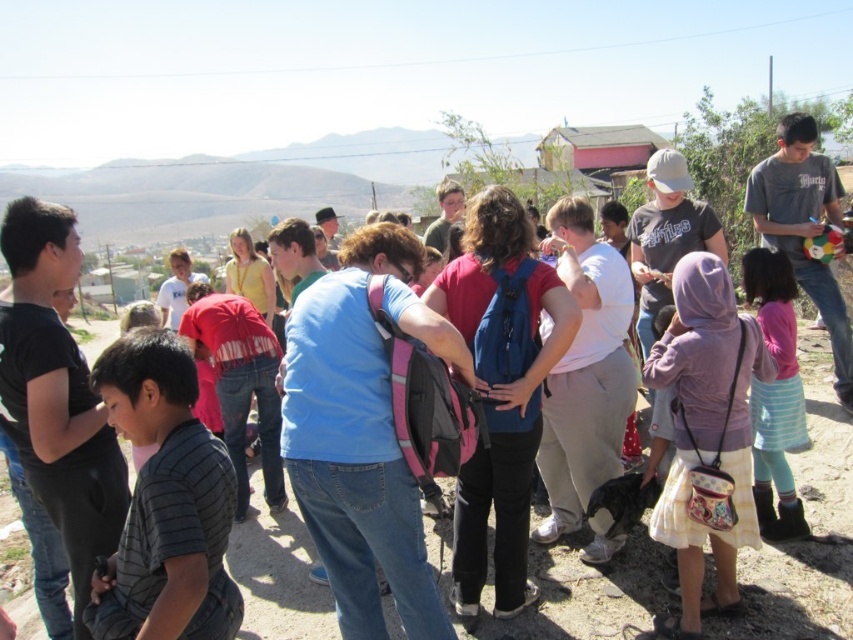
Between purple fabric purse at center and pink fabric dress at lower right, which one has less height?

With less height is pink fabric dress at lower right.

You are a GUI agent. You are given a task and a screenshot of the screen. Output one action in this format:
    pyautogui.click(x=<x>, y=<y>)
    Task: Click on the purple fabric purse at center
    This screenshot has width=853, height=640.
    Given the screenshot: What is the action you would take?
    pyautogui.click(x=706, y=429)

Image resolution: width=853 pixels, height=640 pixels. What do you see at coordinates (706, 429) in the screenshot?
I see `purple fabric purse at center` at bounding box center [706, 429].

Find the location of `purple fabric purse at center`. purple fabric purse at center is located at coordinates (706, 429).

Does striped cotton shirt at lower left appear on the left side of purple fabric purse at center?

Indeed, striped cotton shirt at lower left is positioned on the left side of purple fabric purse at center.

Is striped cotton shirt at lower left taller than purple fabric purse at center?

No, striped cotton shirt at lower left is not taller than purple fabric purse at center.

Does point (206, 509) lie behind point (717, 536)?

No, (206, 509) is in front of (717, 536).

The height and width of the screenshot is (640, 853). In order to click on striped cotton shirt at lower left in this screenshot , I will do pos(166,500).

Between striped cotton shirt at lower left and pink fabric dress at lower right, which one has less height?

striped cotton shirt at lower left is shorter.

Can you confirm if striped cotton shirt at lower left is smaller than pink fabric dress at lower right?

Indeed, striped cotton shirt at lower left has a smaller size compared to pink fabric dress at lower right.

Does point (119, 596) lie in front of point (781, 346)?

That is True.

Where is `striped cotton shirt at lower left`? The width and height of the screenshot is (853, 640). striped cotton shirt at lower left is located at coordinates (166, 500).